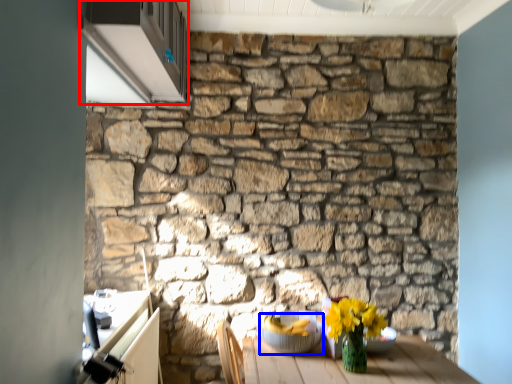
Question: Among these objects, which one is nearest to the camera, window (highlighted by a red box) or glass bowl (highlighted by a blue box)?

Choices:
 (A) window
 (B) glass bowl

Answer: (A)